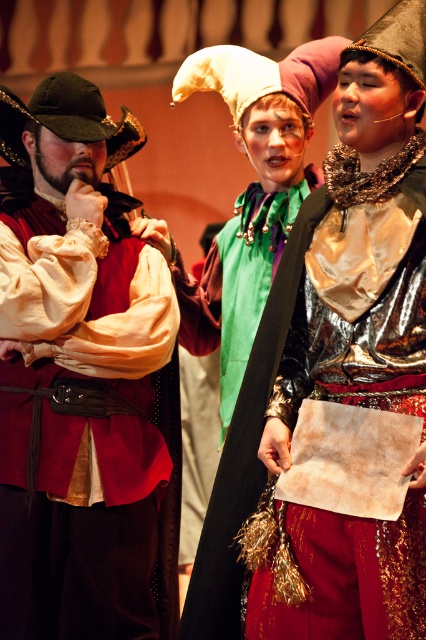
Who is positioned more to the right, matte red vest at left or metallic gold dress at center?

Positioned to the right is metallic gold dress at center.

From the picture: Is matte red vest at left further to the viewer compared to metallic gold dress at center?

Yes, it is behind metallic gold dress at center.

Does point (144, 371) lie in front of point (261, 566)?

No, it is not.

This screenshot has width=426, height=640. Identify the location of matte red vest at left. (80, 378).